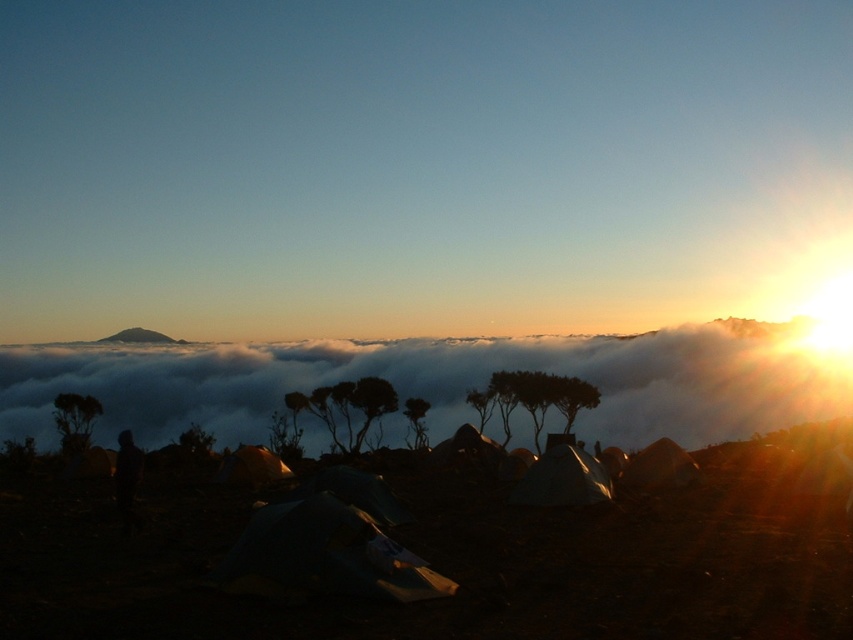
Question: Which object is positioned farthest from the matte silver tent at lower right?

Choices:
 (A) matte green tent at center
 (B) dark fabric figure at lower center

Answer: (B)

Question: Which point is farther to the camera?

Choices:
 (A) white fabric tent at center
 (B) green fabric tent at center
 (C) smooth gray mountain at upper center
 (D) dark fabric figure at lower center

Answer: (C)

Question: Is white fluffy cloud at center wider than dark fabric figure at lower center?

Choices:
 (A) no
 (B) yes

Answer: (B)

Question: Considering the real-world distances, which object is farthest from the white fabric tent at lower right?

Choices:
 (A) dark fabric figure at lower center
 (B) matte green tent at center
 (C) white fabric tent at center
 (D) matte silver tent at lower right

Answer: (A)

Question: Does white fabric tent at center have a smaller size compared to dark fabric figure at lower center?

Choices:
 (A) yes
 (B) no

Answer: (A)

Question: Is the position of white fluffy cloud at center more distant than that of green fabric tent at center?

Choices:
 (A) no
 (B) yes

Answer: (B)